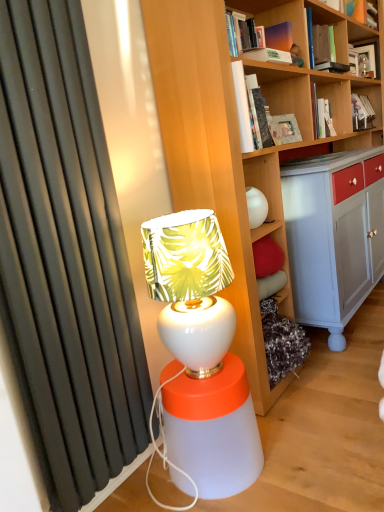
Find the location of a particular element. The height and width of the screenshot is (512, 384). free space underneath white glossy table lamp at center (from a real-world perspective) is located at coordinates (211, 376).